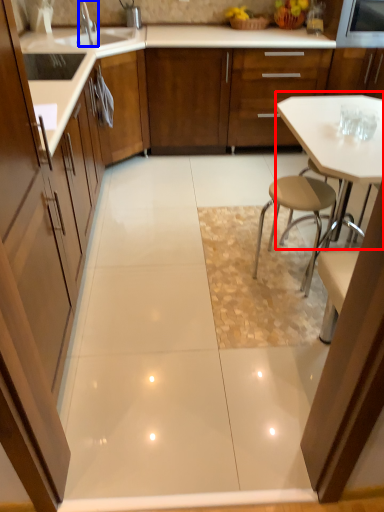
Question: Which point is further to the camera, table (highlighted by a red box) or tap (highlighted by a blue box)?

Choices:
 (A) table
 (B) tap

Answer: (B)